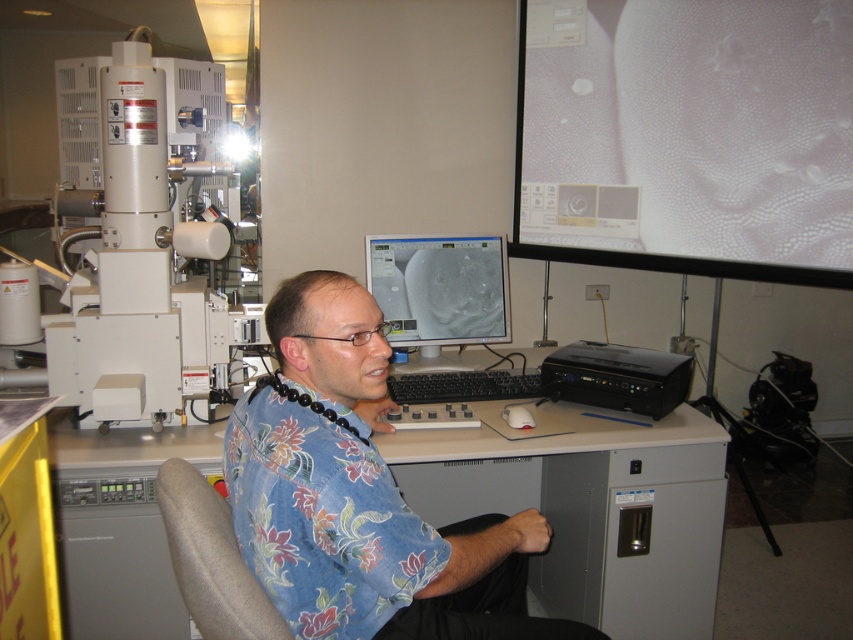
What are the coordinates of the gray matte computer desk at center?

The gray matte computer desk at center is located at point (590, 508).

You are a researcher in the lab and need to place a microscope slide on the gray matte computer desk at center. Where exactly should you place it?

The gray matte computer desk at center is located at point (590,508), so you should place the microscope slide there.

You are navigating a virtual 3D model of the laboratory. You need to move from point A to point B. Point A is at coordinates point (421, 316) and point B is at coordinates point (271, 621). Which point is closer to you when you are facing the desk?

Point A at coordinates point (421, 316) is closer to you because it is further to the viewer than point B at coordinates point (271, 621).